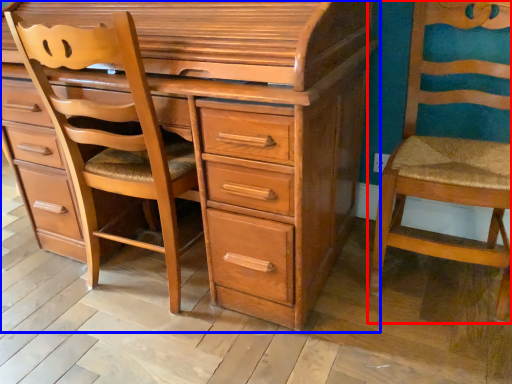
Question: Which of the following is the closest to the observer, chair (highlighted by a red box) or chest of drawers (highlighted by a blue box)?

Choices:
 (A) chair
 (B) chest of drawers

Answer: (B)